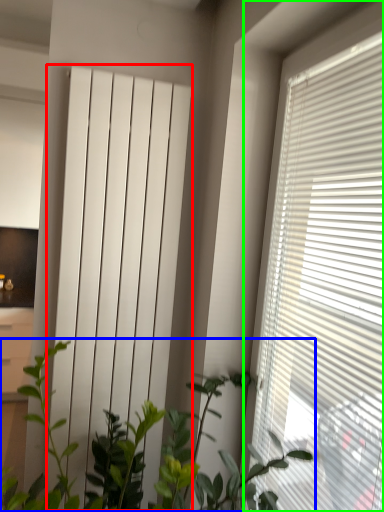
Question: Which object is the closest to the curtain (highlighted by a red box)? Choose among these: houseplant (highlighted by a blue box) or window blind (highlighted by a green box).

Choices:
 (A) houseplant
 (B) window blind

Answer: (A)